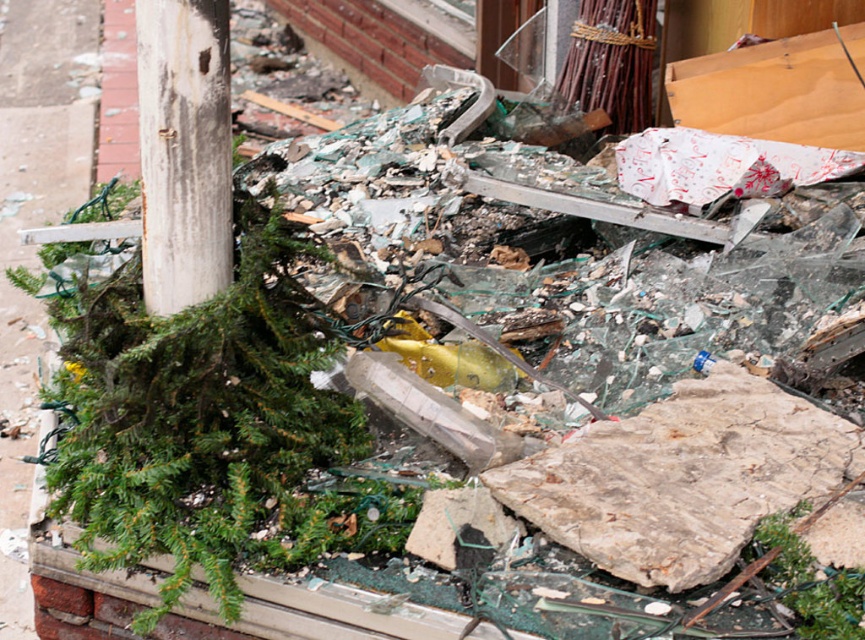
Which is more to the right, brown concrete pavement at left or white weathered wood post at upper left?

white weathered wood post at upper left

Which is behind, point (46, 38) or point (191, 140)?

The point (46, 38) is behind.

Find the location of `brown concrete pavement at left`. brown concrete pavement at left is located at coordinates (35, 225).